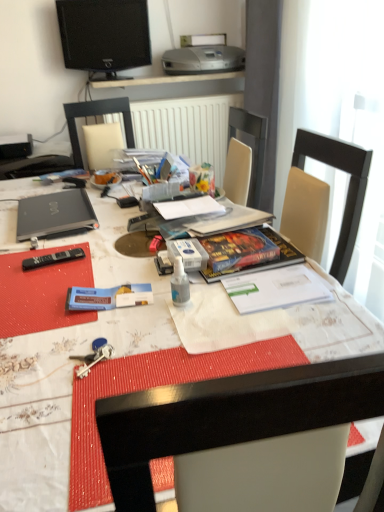
You are a GUI agent. You are given a task and a screenshot of the screen. Output one action in this format:
    pyautogui.click(x=<x>, y=<y>)
    Task: Click on the vacant area on the back side of transparent plastic spray bottle at center
    The image size is (384, 512).
    Given the screenshot: What is the action you would take?
    pyautogui.click(x=163, y=275)